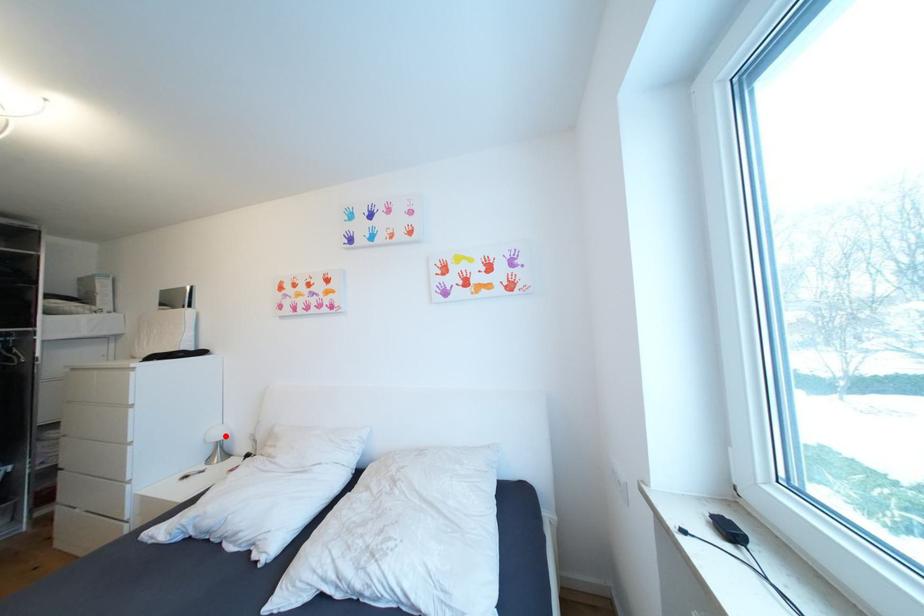
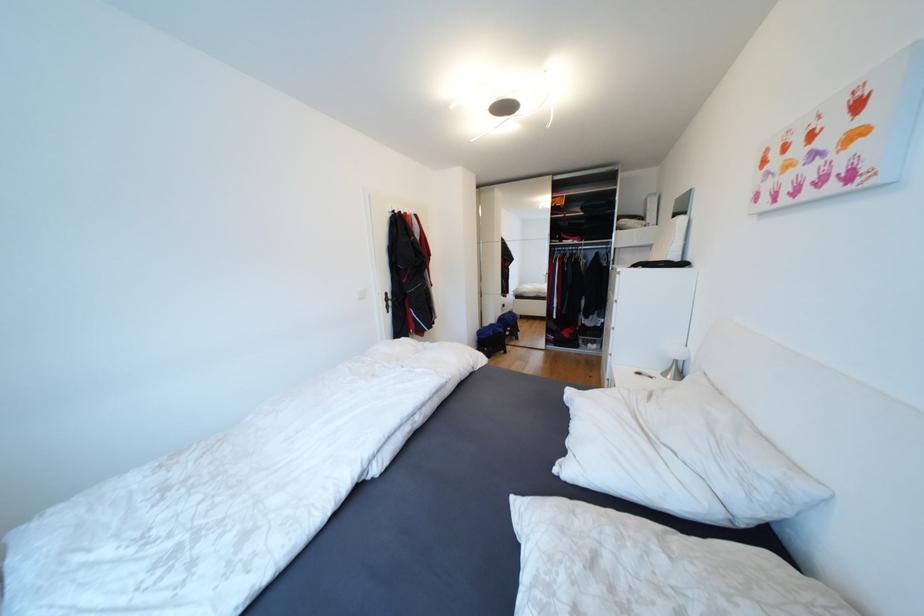
Locate, in the second image, the point that corresponds to the highlighted location in the first image.

(682, 354)